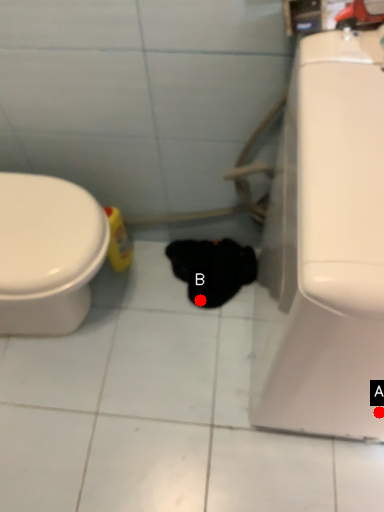
Question: Two points are circled on the image, labeled by A and B beside each circle. Which point appears farthest from the camera in this image?

Choices:
 (A) A is further
 (B) B is further

Answer: (B)